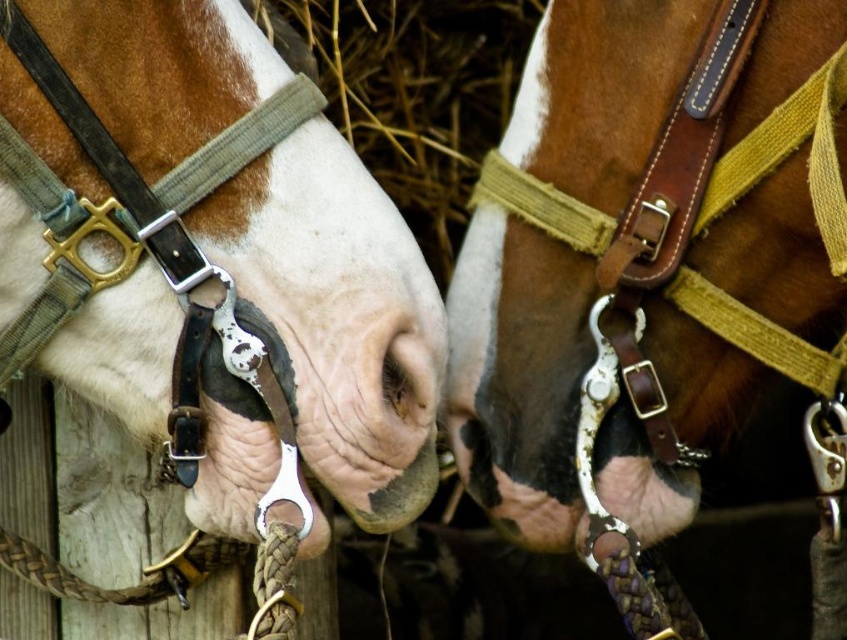
Question: Can you confirm if matte black halter at left is positioned above matte black nose at center?

Choices:
 (A) no
 (B) yes

Answer: (B)

Question: Is matte black halter at left positioned behind matte black nose at center?

Choices:
 (A) no
 (B) yes

Answer: (A)

Question: Which of the following is the farthest from the observer?

Choices:
 (A) matte black nose at center
 (B) matte black halter at left

Answer: (A)

Question: Which object appears closest to the camera in this image?

Choices:
 (A) brown leather halter at center
 (B) matte black halter at left
 (C) matte black nose at center

Answer: (A)

Question: Can you confirm if brown leather halter at center is positioned above matte black nose at center?

Choices:
 (A) yes
 (B) no

Answer: (A)

Question: Which is nearer to the brown leather halter at center?

Choices:
 (A) matte black halter at left
 (B) matte black nose at center

Answer: (B)